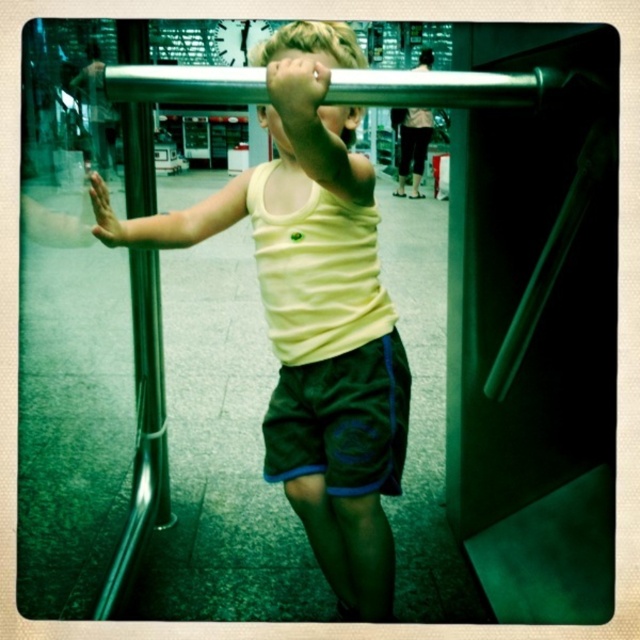
Is yellow matte tank top at center taller than silver metallic rail at upper center?

Yes.

Which is behind, point (369, 595) or point (548, 81)?

Point (369, 595)

Between point (236, 186) and point (449, 96), which one is positioned behind?

The point (236, 186) is behind.

Locate an element on the screen. The width and height of the screenshot is (640, 640). yellow matte tank top at center is located at coordinates (314, 312).

Can you confirm if dark blue cotton shorts at center is positioned above silver metallic rail at upper center?

No.

Is dark blue cotton shorts at center to the right of silver metallic rail at upper center from the viewer's perspective?

Yes, dark blue cotton shorts at center is to the right of silver metallic rail at upper center.

Is point (378, 397) farther from camera compared to point (390, 92)?

That is True.

Find the location of a particular element. The height and width of the screenshot is (640, 640). dark blue cotton shorts at center is located at coordinates (340, 420).

Is silver metallic rail at upper center below satin silver pole at left?

No, silver metallic rail at upper center is not below satin silver pole at left.

Can you confirm if silver metallic rail at upper center is positioned to the left of satin silver pole at left?

In fact, silver metallic rail at upper center is to the right of satin silver pole at left.

Does point (221, 77) come farther from viewer compared to point (140, 296)?

No, (221, 77) is closer to viewer.

I want to click on silver metallic rail at upper center, so click(442, 88).